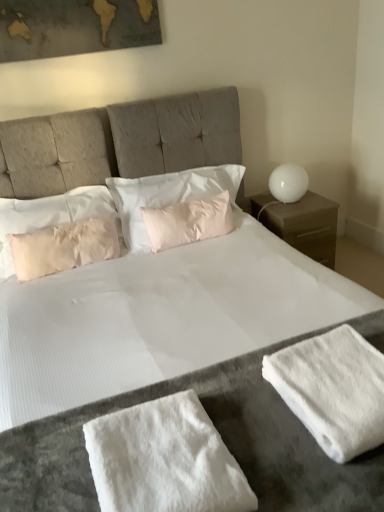
Identify the location of vacant area on top of white fluffy bath towel at lower right (from a real-world perspective). (344, 375).